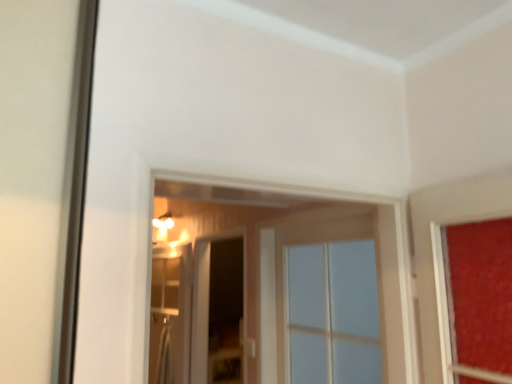
Question: Is clear glass screen door at center, placed as the 1th screen door when sorted from left to right, inside or outside of clear glass screen door at center, which ranks as the second screen door in left-to-right order?

Choices:
 (A) outside
 (B) inside

Answer: (A)

Question: From a real-world perspective, is clear glass screen door at center, arranged as the second screen door when viewed from the right, positioned above or below clear glass screen door at center, which ranks as the second screen door in left-to-right order?

Choices:
 (A) below
 (B) above

Answer: (A)

Question: Based on their relative distances, which object is farther from the clear glass screen door at center, arranged as the second screen door when viewed from the right?

Choices:
 (A) clear glass screen door at center, marked as the 1th screen door in a right-to-left arrangement
 (B) clear glass window at center

Answer: (B)

Question: Based on their relative distances, which object is farther from the clear glass screen door at center, marked as the 1th screen door in a right-to-left arrangement?

Choices:
 (A) clear glass screen door at center, placed as the 1th screen door when sorted from left to right
 (B) clear glass window at center

Answer: (B)